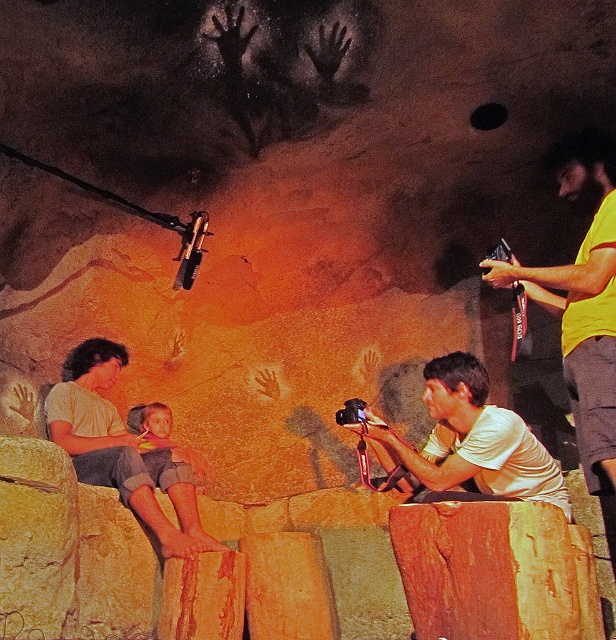
Who is shorter, yellow fabric shirt at upper right or matte white shirt at center?

Standing shorter between the two is matte white shirt at center.

Is point (601, 144) closer to viewer compared to point (447, 460)?

Yes, it is in front of point (447, 460).

The width and height of the screenshot is (616, 640). I want to click on yellow fabric shirt at upper right, so click(x=582, y=298).

Does point (496, 488) come behind point (105, 445)?

No, it is not.

Does matte white shirt at center appear on the right side of matte yellow shirt at left?

Correct, you'll find matte white shirt at center to the right of matte yellow shirt at left.

Which is in front, point (464, 356) or point (87, 432)?

Point (464, 356) is more forward.

You are a GUI agent. You are given a task and a screenshot of the screen. Output one action in this format:
    pyautogui.click(x=<x>, y=<y>)
    Task: Click on the matte white shirt at center
    
    Given the screenshot: What is the action you would take?
    pyautogui.click(x=471, y=440)

Which is more to the right, yellow fabric shirt at upper right or matte yellow shirt at left?

yellow fabric shirt at upper right is more to the right.

Does point (572, 396) come in front of point (195, 497)?

Yes, point (572, 396) is closer to viewer.

This screenshot has width=616, height=640. What are the coordinates of `yellow fabric shirt at upper right` in the screenshot? It's located at (582, 298).